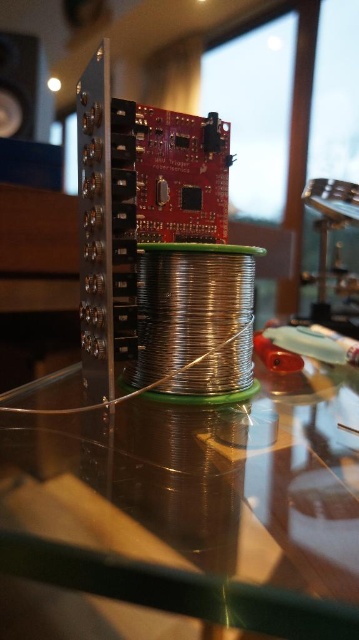
You are standing at the edge of the workspace looking towards the center. There are two points marked on the glass surface where you might place tools. The first point is at coordinate point(x=84, y=547) and the second at point(x=5, y=74). Which point is closer to you?

Point(x=84, y=547) is closer to you because it is in front of point(x=5, y=74).

You are an engineer working in this workspace. You need to place a heavy tool on the transparent glass table at center and the black glossy speaker at upper left. Which surface can better support the weight without breaking?

The transparent glass table at center is closer to the viewer than the black glossy speaker at upper left, so it is more accessible and likely has a stronger structure to support heavy tools.